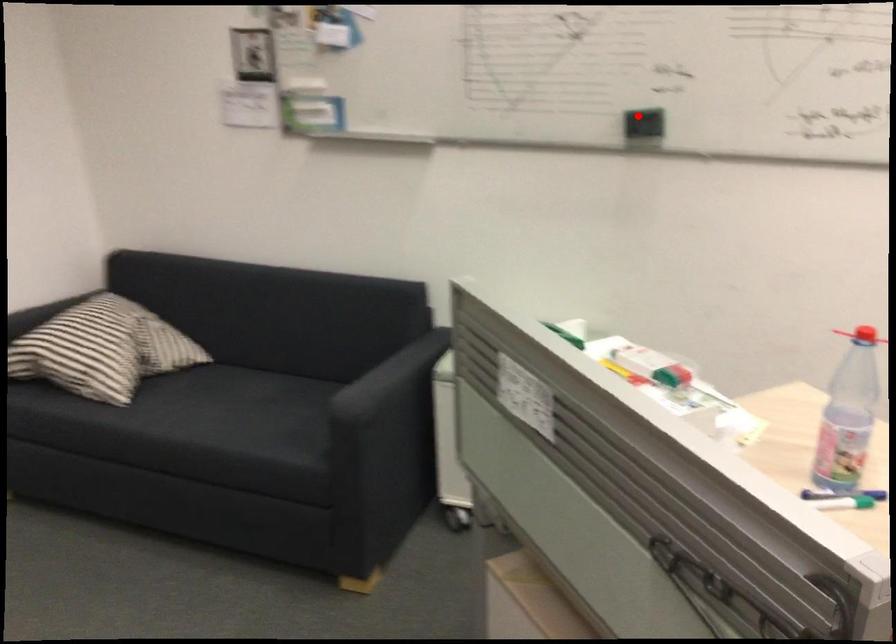
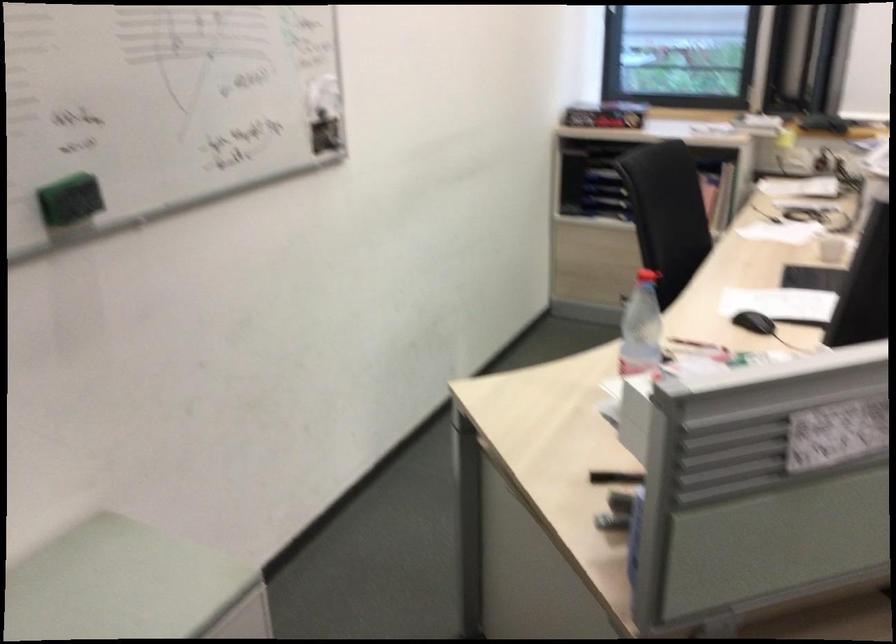
Question: I am providing you with two images of the same scene from different viewpoints. A red point is shown in image1. For the corresponding object point in image2, is it positioned nearer or farther from the camera?

Choices:
 (A) Nearer
 (B) Farther

Answer: (A)